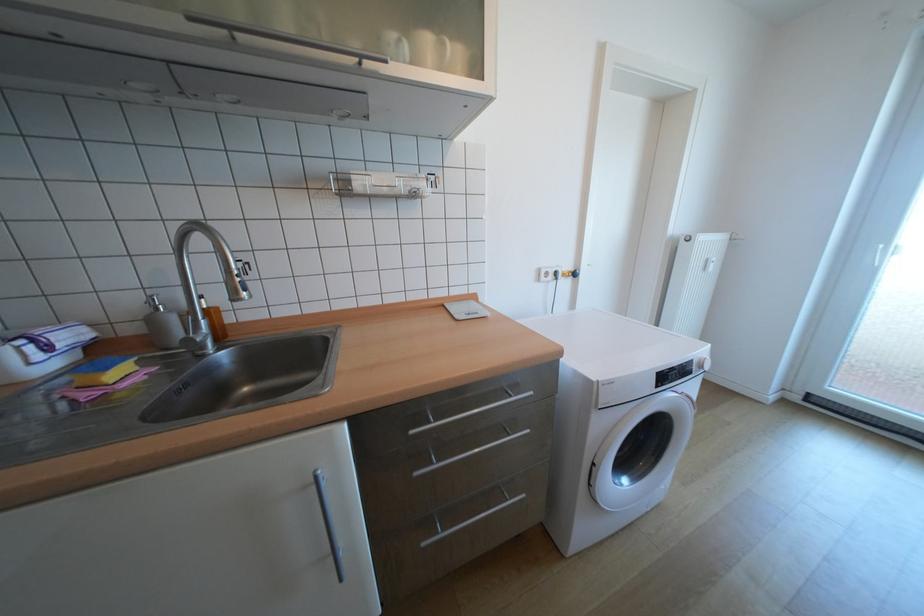
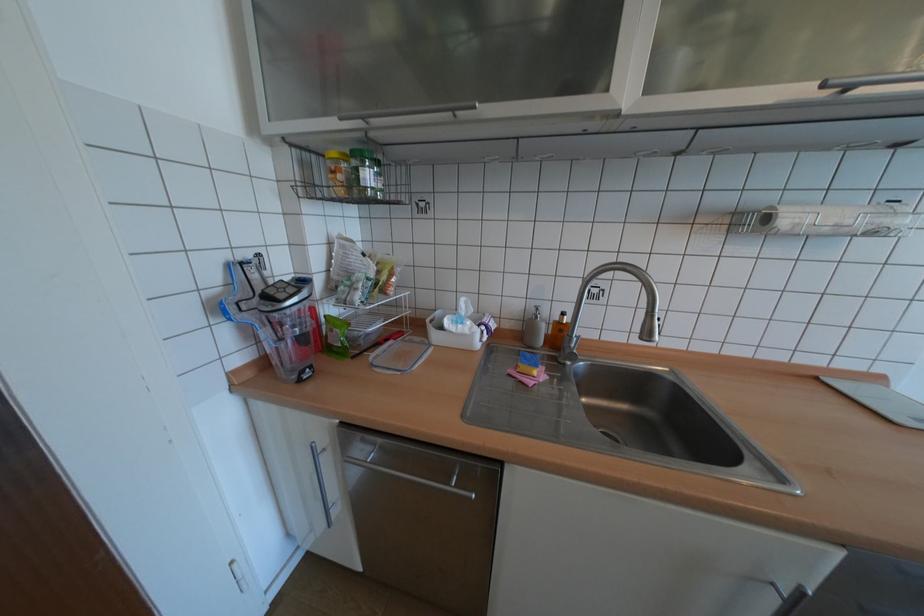
In the second image, find the point that corresponds to (213,353) in the first image.

(574, 363)